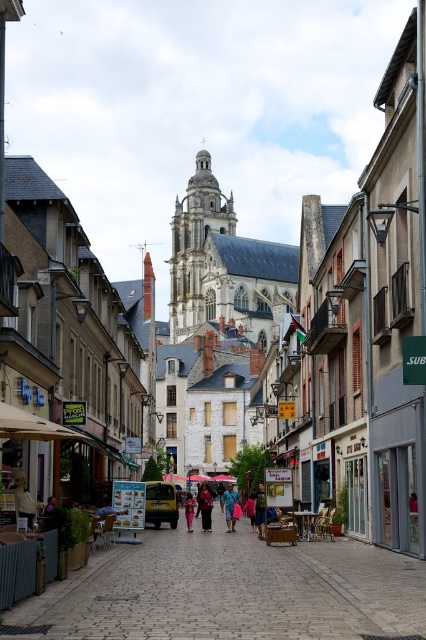
Question: Which of the following is the closest to the observer?

Choices:
 (A) (226, 509)
 (B) (255, 518)
 (C) (201, 477)
 (D) (189, 268)

Answer: (A)

Question: Can you confirm if white stone tower at center is wider than pink fabric dress at center?

Choices:
 (A) yes
 (B) no

Answer: (A)

Question: Can you confirm if white stone church at center is positioned to the right of white stone tower at center?

Choices:
 (A) yes
 (B) no

Answer: (A)

Question: Considering the real-world distances, which object is farthest from the white stone church at center?

Choices:
 (A) dark blue jeans at center
 (B) pink fabric dress at center
 (C) pink fabric at center

Answer: (C)

Question: Among these points, which one is farthest from the camera?

Choices:
 (A) pos(270,296)
 (B) pos(233,480)

Answer: (A)

Question: Can you confirm if pink fabric dress at center is thinner than white fabric umbrella at center?

Choices:
 (A) no
 (B) yes

Answer: (B)